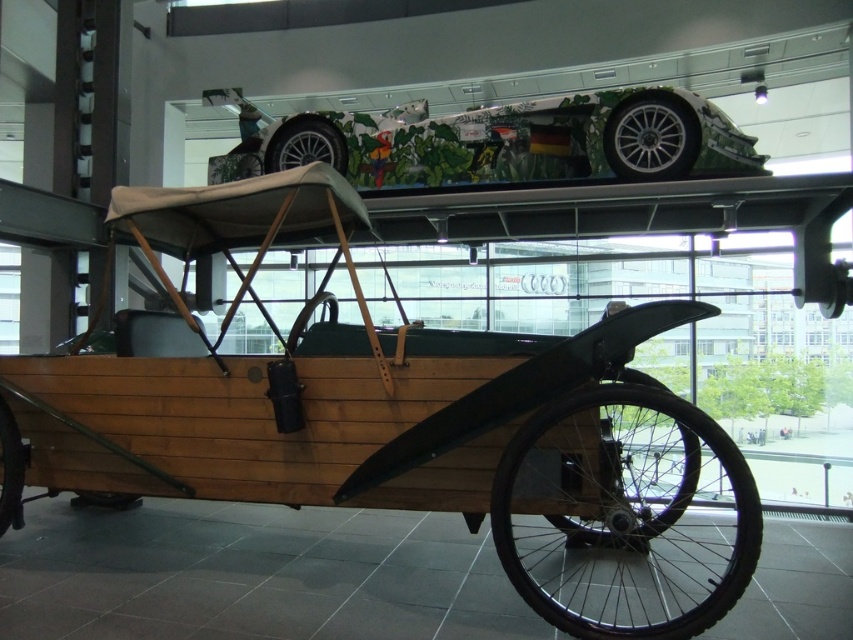
Who is shorter, wooden tricycle at lower left or green leafy paintwork at upper center?

With less height is green leafy paintwork at upper center.

In the scene shown: Is wooden tricycle at lower left wider than green leafy paintwork at upper center?

No.

Who is more distant from viewer, (698, 540) or (761, 173)?

The point (761, 173) is more distant.

Image resolution: width=853 pixels, height=640 pixels. I want to click on wooden tricycle at lower left, so click(x=393, y=420).